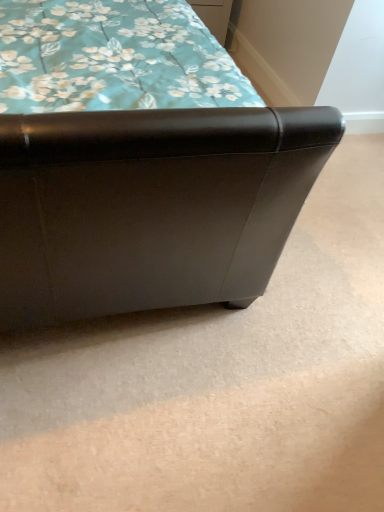
Question: Is matte black ottoman at lower left completely or partially outside of matte wood drawer at upper center?

Choices:
 (A) yes
 (B) no

Answer: (A)

Question: Is matte black ottoman at lower left to the right of matte wood drawer at upper center from the viewer's perspective?

Choices:
 (A) no
 (B) yes

Answer: (A)

Question: Is matte black ottoman at lower left in contact with matte wood drawer at upper center?

Choices:
 (A) no
 (B) yes

Answer: (A)

Question: Does matte black ottoman at lower left have a smaller size compared to matte wood drawer at upper center?

Choices:
 (A) no
 (B) yes

Answer: (A)

Question: Would you say matte wood drawer at upper center is part of matte black ottoman at lower left's contents?

Choices:
 (A) yes
 (B) no

Answer: (B)

Question: From the image's perspective, is matte black ottoman at lower left on top of matte wood drawer at upper center?

Choices:
 (A) yes
 (B) no

Answer: (B)

Question: Does matte wood drawer at upper center have a greater height compared to matte black ottoman at lower left?

Choices:
 (A) yes
 (B) no

Answer: (B)

Question: From the image's perspective, does matte wood drawer at upper center appear higher than matte black ottoman at lower left?

Choices:
 (A) no
 (B) yes

Answer: (B)

Question: Is matte wood drawer at upper center not inside matte black ottoman at lower left?

Choices:
 (A) no
 (B) yes

Answer: (B)

Question: Is matte wood drawer at upper center facing away from matte black ottoman at lower left?

Choices:
 (A) no
 (B) yes

Answer: (A)

Question: Can you confirm if matte wood drawer at upper center is positioned to the right of matte black ottoman at lower left?

Choices:
 (A) yes
 (B) no

Answer: (A)

Question: Is matte black ottoman at lower left a part of matte wood drawer at upper center?

Choices:
 (A) no
 (B) yes

Answer: (A)

Question: Is matte wood drawer at upper center taller or shorter than matte black ottoman at lower left?

Choices:
 (A) short
 (B) tall

Answer: (A)